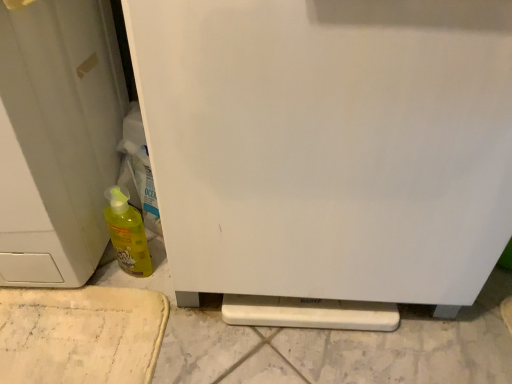
Question: Is white matte refrigerator at center inside or outside of white matte door at left?

Choices:
 (A) inside
 (B) outside

Answer: (B)

Question: Is white matte refrigerator at center bigger or smaller than white matte door at left?

Choices:
 (A) big
 (B) small

Answer: (B)

Question: Estimate the real-world distances between objects in this image. Which object is farther from the yellow translucent bottle at lower left?

Choices:
 (A) white matte door at left
 (B) white matte refrigerator at center

Answer: (B)

Question: Which object is positioned farthest from the white matte refrigerator at center?

Choices:
 (A) white matte door at left
 (B) yellow translucent bottle at lower left

Answer: (B)